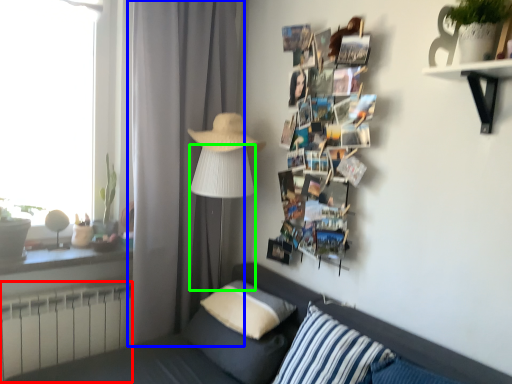
Question: Which object is positioned farthest from radiator (highlighted by a red box)? Select from curtain (highlighted by a blue box) and table lamp (highlighted by a green box).

Choices:
 (A) curtain
 (B) table lamp

Answer: (B)